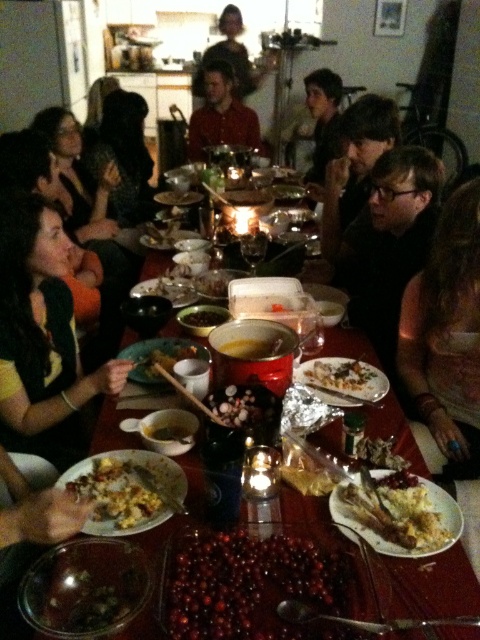
Who is taller, blonde hair at upper center or slightly browned bread at center?

With more height is blonde hair at upper center.

Is point (231, 33) more distant than point (155, 426)?

Yes, point (231, 33) is behind point (155, 426).

Where is `blonde hair at upper center`? This screenshot has width=480, height=640. blonde hair at upper center is located at coordinates (231, 58).

Does dark brown hair at lower right appear on the left side of blonde hair at upper center?

Incorrect, dark brown hair at lower right is not on the left side of blonde hair at upper center.

The width and height of the screenshot is (480, 640). I want to click on dark brown hair at lower right, so click(445, 333).

Can you confirm if golden brown bread at lower right is positioned to the left of green matte bowl at center?

No, golden brown bread at lower right is not to the left of green matte bowl at center.

Which is in front, point (414, 509) or point (140, 368)?

Point (414, 509)

Between point (374, 532) and point (166, 358), which one is positioned in front?

Positioned in front is point (374, 532).

Find the location of a particular element. golden brown bread at lower right is located at coordinates (398, 516).